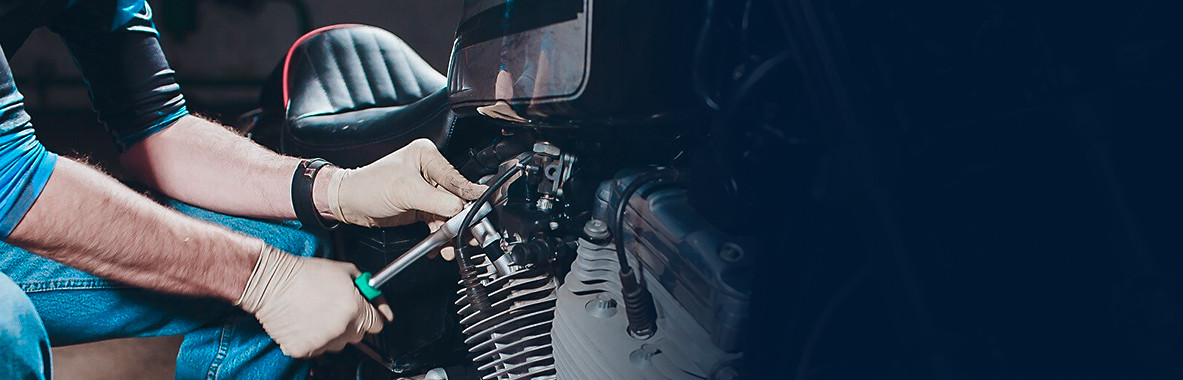
Where is `handle`? The height and width of the screenshot is (380, 1183). handle is located at coordinates (364, 286).